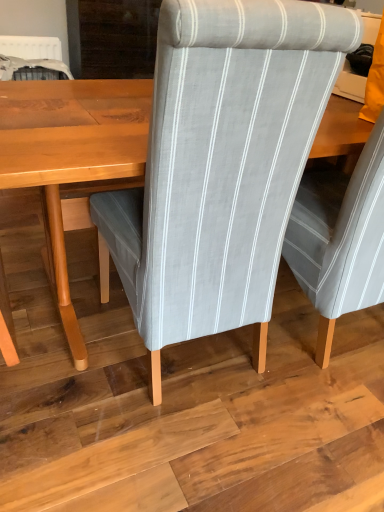
This screenshot has width=384, height=512. I want to click on vacant area that is in front of light gray fabric chair at center, so click(161, 448).